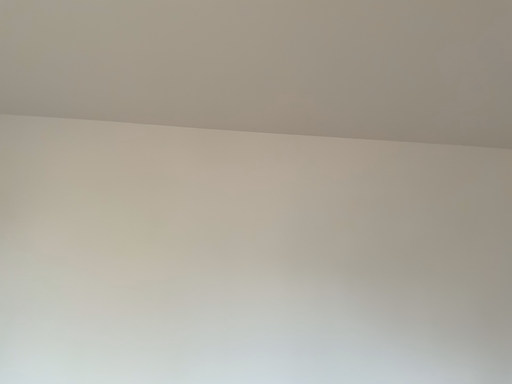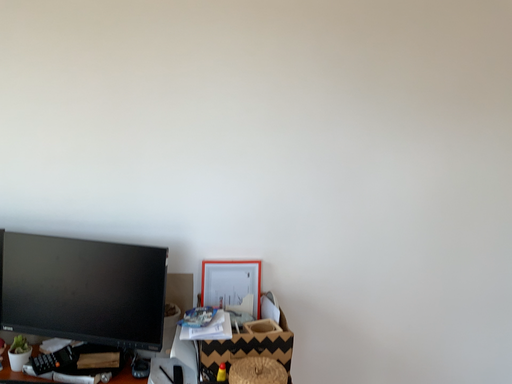
Question: Which way did the camera rotate in the video?

Choices:
 (A) rotated downward
 (B) rotated upward

Answer: (A)